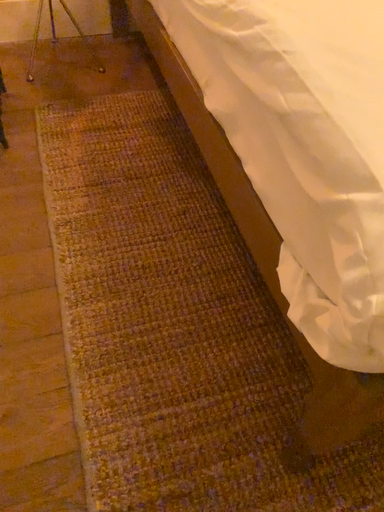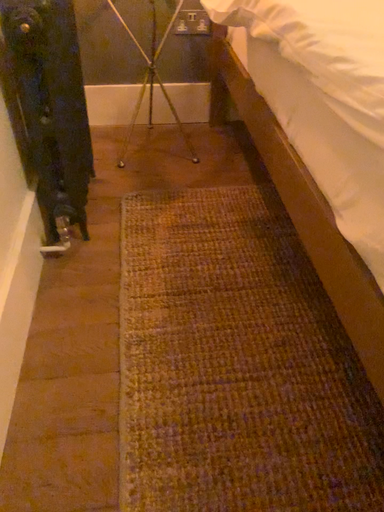
Question: Which way did the camera rotate in the video?

Choices:
 (A) rotated upward
 (B) rotated downward

Answer: (A)